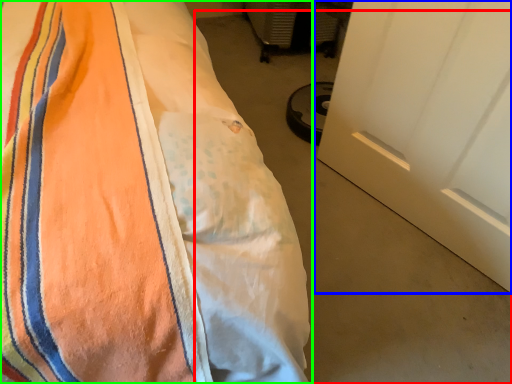
Question: Which is farther away from concrete (highlighted by a red box)? door (highlighted by a blue box) or bed (highlighted by a green box)?

Choices:
 (A) door
 (B) bed

Answer: (B)